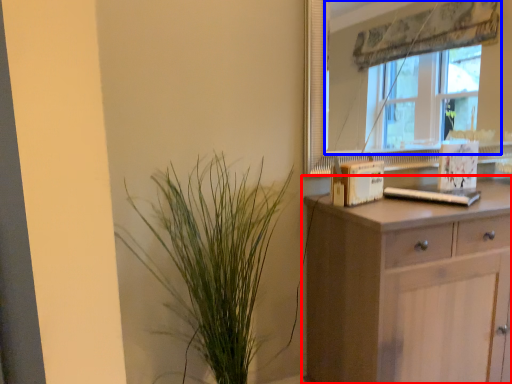
Question: Which of the following is the farthest to the observer, chest of drawers (highlighted by a red box) or window (highlighted by a blue box)?

Choices:
 (A) chest of drawers
 (B) window

Answer: (B)